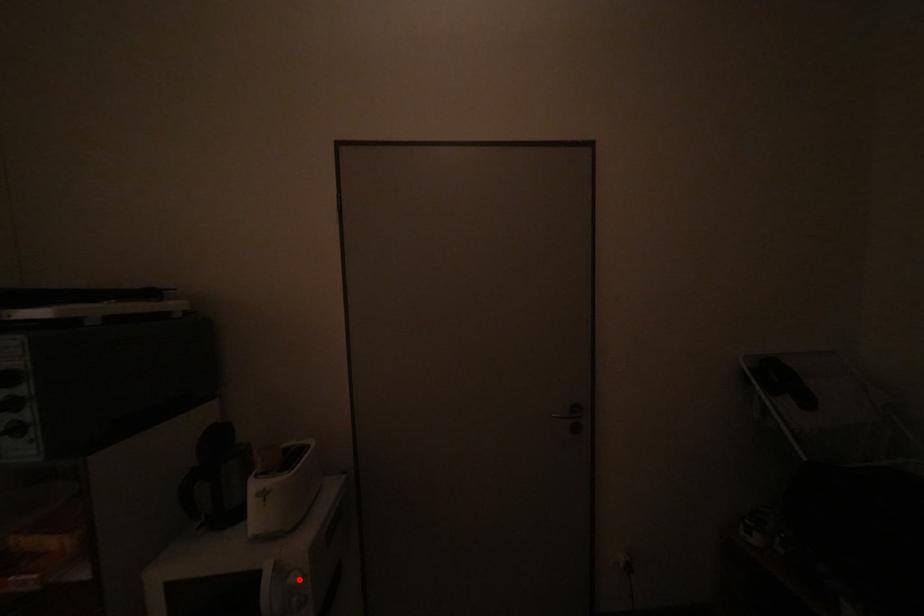
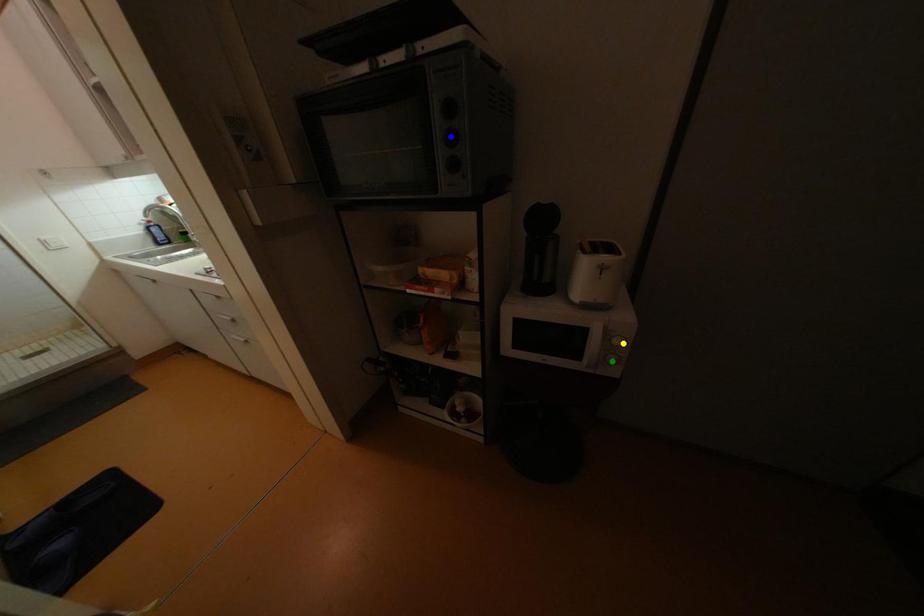
Question: I am providing you with two images of the same scene from different viewpoints. A red point is marked on the first image. You are given multiple points on the second image. Can you choose the point in image 2 that corresponds to the point in image 1?

Choices:
 (A) yellow point
 (B) green point
 (C) blue point

Answer: (A)